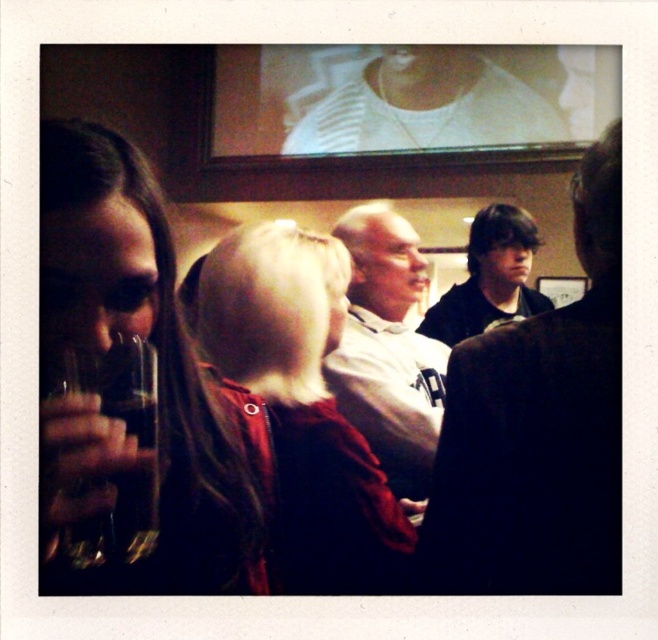
You are a photographer at the event and need to capture a photo that includes both the white matte shirt at center and the translucent glass beverage at lower left. Which object should you adjust your camera focus to prioritize if you want the wider object to be in focus?

The white matte shirt at center is wider than the translucent glass beverage at lower left, so you should prioritize focusing on the white matte shirt at center to ensure the wider object is in focus.